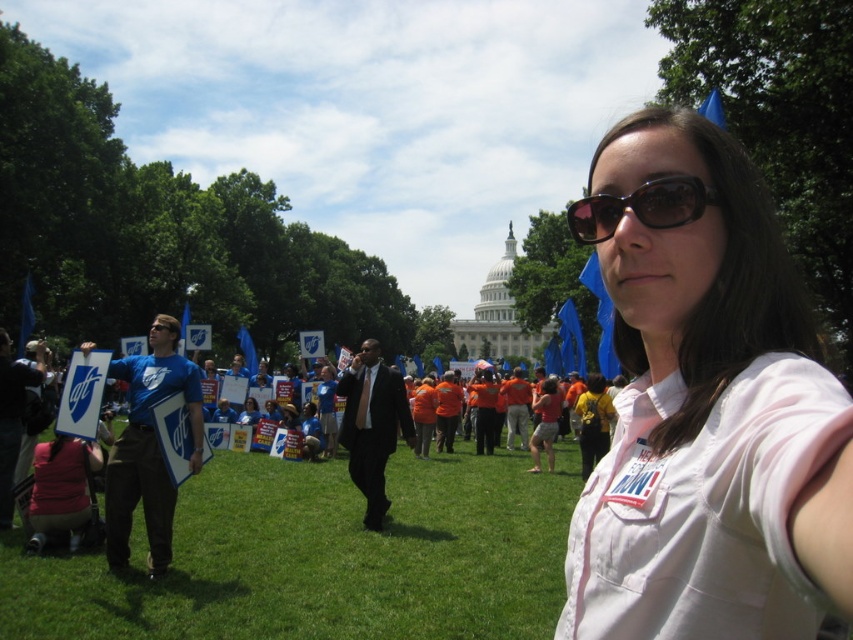
Is white matte shirt at center thinner than black plastic sunglasses at upper center?

In fact, white matte shirt at center might be wider than black plastic sunglasses at upper center.

Which of these two, white matte shirt at center or black plastic sunglasses at upper center, stands taller?

Standing taller between the two is white matte shirt at center.

The width and height of the screenshot is (853, 640). What are the coordinates of `white matte shirt at center` in the screenshot? It's located at (705, 404).

Which is more to the right, white matte shirt at center or green grass at lower center?

white matte shirt at center

Is point (845, 538) positioned before point (117, 602)?

Yes, point (845, 538) is closer to viewer.

Is point (640, 300) farther from viewer compared to point (447, 568)?

No, (640, 300) is in front of (447, 568).

At what (x,y) coordinates should I click in order to perform the action: click on white matte shirt at center. Please return your answer as a coordinate pair (x, y). The image size is (853, 640). Looking at the image, I should click on (705, 404).

Does green grass at lower center have a greater height compared to black plastic sunglasses at upper center?

Indeed, green grass at lower center has a greater height compared to black plastic sunglasses at upper center.

Is point (270, 534) positioned after point (601, 230)?

Yes, point (270, 534) is farther from viewer.

The image size is (853, 640). Find the location of `green grass at lower center`. green grass at lower center is located at coordinates (322, 557).